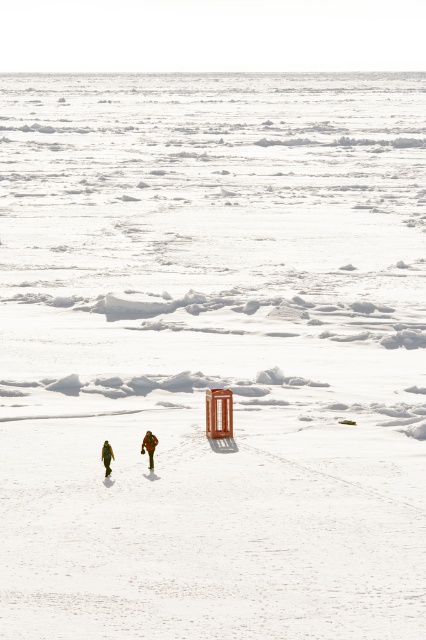
From the picture: Between orange fabric jacket at center and green matte jacket at lower center, which one is positioned higher?

orange fabric jacket at center is above.

Who is positioned more to the right, orange fabric jacket at center or green matte jacket at lower center?

From the viewer's perspective, orange fabric jacket at center appears more on the right side.

Find the location of `orange fabric jacket at center`. orange fabric jacket at center is located at coordinates (149, 445).